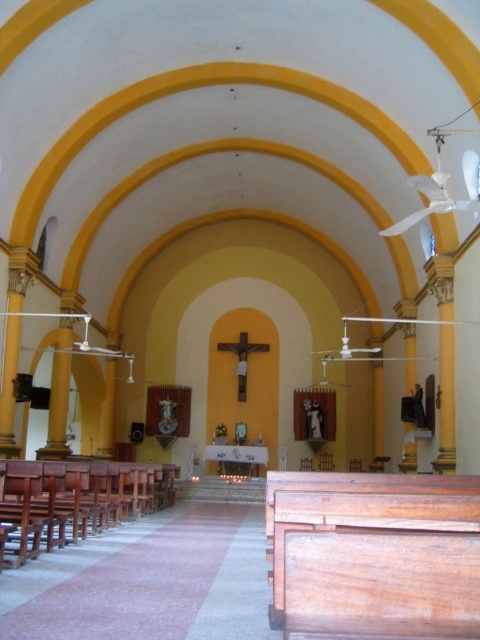
Between wooden church bench at lower right and wooden church bench at left, which one has less height?

With less height is wooden church bench at left.

Between wooden church bench at lower right and wooden church bench at left, which one is positioned lower?

wooden church bench at left is below.

Looking at this image, measure the distance between point (x=342, y=484) and camera.

A distance of 14.49 feet exists between point (x=342, y=484) and camera.

At what (x,y) coordinates should I click in order to perform the action: click on wooden church bench at lower right. Please return your answer as a coordinate pair (x, y). The width and height of the screenshot is (480, 640). Looking at the image, I should click on (374, 556).